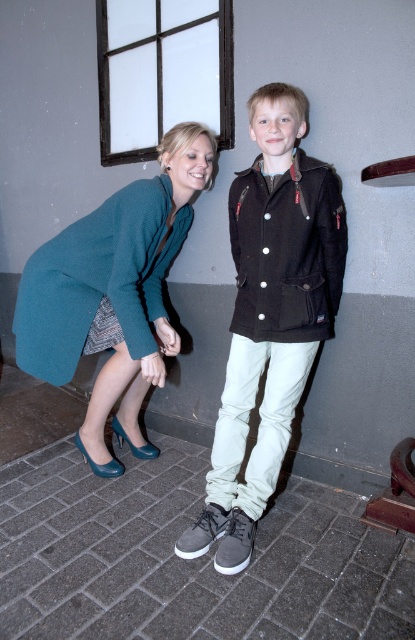
You are standing in the room and want to place a small plant between the two points, point (336,260) and point (187,208). Which point should the plant be closer to so that it is closer to the person on the left?

The plant should be closer to point (187,208) because point (336,260) is in front of point (187,208), meaning it is closer to the observer. Placing the plant closer to the point behind would still keep it between them while being nearer to the person on the left.

You are a photographer setting up a shoot in this scene. You need to place a small prop between the dark brown leather jacket at center and the teal fabric coat at lower left. Based on their positions, where should you place the prop so it is equidistant from both?

The dark brown leather jacket at center is closer to the viewer than the teal fabric coat at lower left, so to place the prop equidistant from both, it should be positioned closer to the teal fabric coat at lower left.

Consider the image. You are a photographer setting up a photo shoot. You have two subjects wearing the dark brown leather jacket at center and the teal fabric coat at lower left. You want to ensure both subjects are fully visible in the frame. Which subject should you position closer to the camera to avoid cropping?

You should position the dark brown leather jacket at center closer to the camera because it occupies less space than the teal fabric coat at lower left, so it can be placed nearer without causing cropping issues while still keeping both subjects visible.